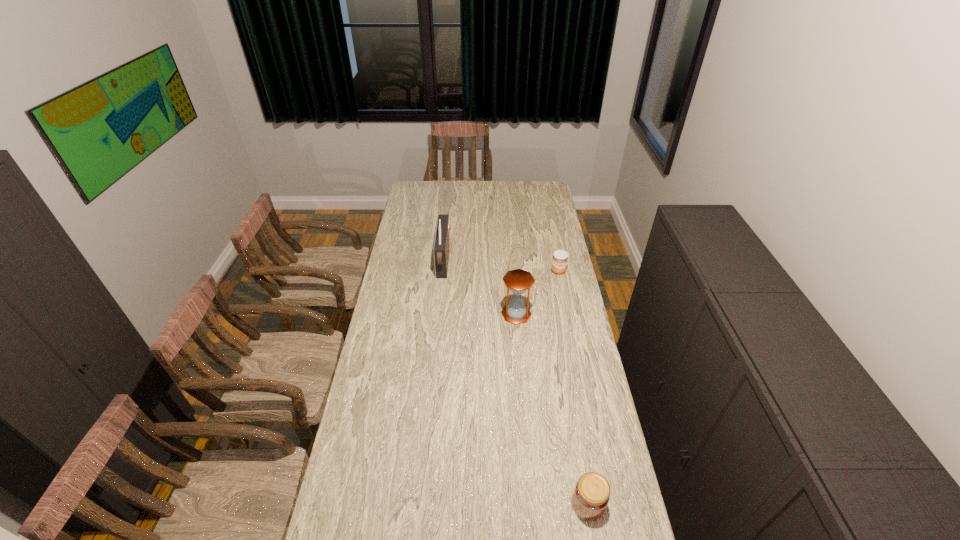
Find the location of `vacant point located between the nearer jam and the leftmost object`. vacant point located between the nearer jam and the leftmost object is located at coordinates (516, 383).

This screenshot has width=960, height=540. I want to click on vacant region between the nearest object and the farther jam, so click(x=573, y=388).

Identify the location of object that ranks as the third closest to the farther jam. (591, 496).

Identify which object is the nearest to the leftmost object. Please provide its 2D coordinates. Your answer should be formatted as a tuple, i.e. [(x, y)], where the tuple contains the x and y coordinates of a point satisfying the conditions above.

[(518, 281)]

Identify the location of free spot that satisfies the following two spatial constraints: 1. on the front side of the second object from left to right; 2. on the left side of the nearest object. Image resolution: width=960 pixels, height=540 pixels. (533, 504).

At what (x,y) coordinates should I click in order to perform the action: click on free location that satisfies the following two spatial constraints: 1. on the front panel of the third farthest object; 2. on the left side of the tallest object. Please return your answer as a coordinate pair (x, y). This screenshot has width=960, height=540. Looking at the image, I should click on (439, 314).

The width and height of the screenshot is (960, 540). Find the location of `vacant space that satisfies the following two spatial constraints: 1. on the front panel of the third shortest object; 2. on the left side of the tallest object`. vacant space that satisfies the following two spatial constraints: 1. on the front panel of the third shortest object; 2. on the left side of the tallest object is located at coordinates pos(439,314).

Locate an element on the screen. The height and width of the screenshot is (540, 960). free location that satisfies the following two spatial constraints: 1. on the front panel of the leftmost object; 2. on the back side of the hourglass is located at coordinates (439, 314).